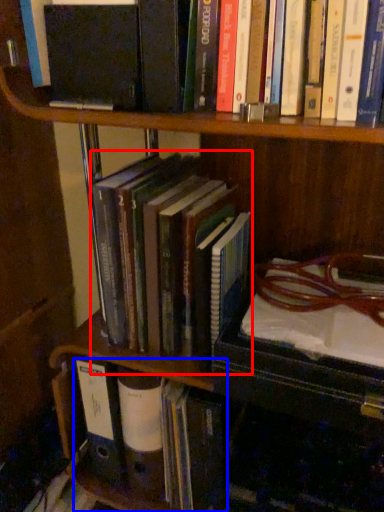
Question: Among these objects, which one is nearest to the camera, book (highlighted by a red box) or book (highlighted by a blue box)?

Choices:
 (A) book
 (B) book

Answer: (A)